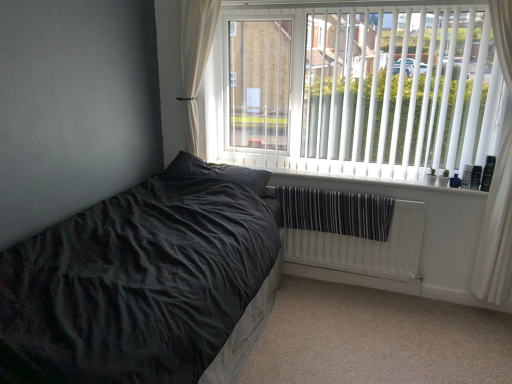
The width and height of the screenshot is (512, 384). Identify the location of vacant area on top of white plastic radiator at lower center (from a real-world perspective). (347, 174).